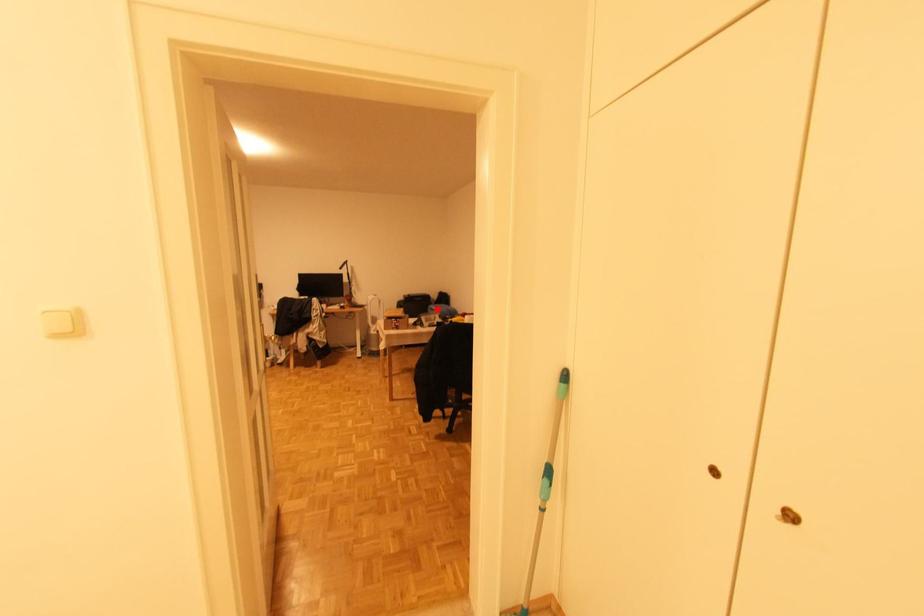
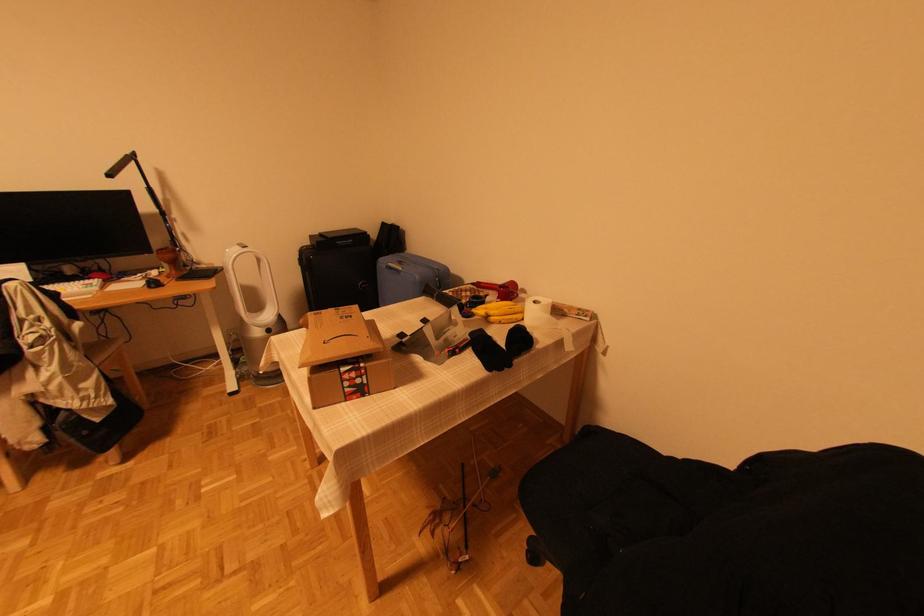
Locate, in the second image, the point that corresponds to the highlighted location in the first image.

(403, 270)